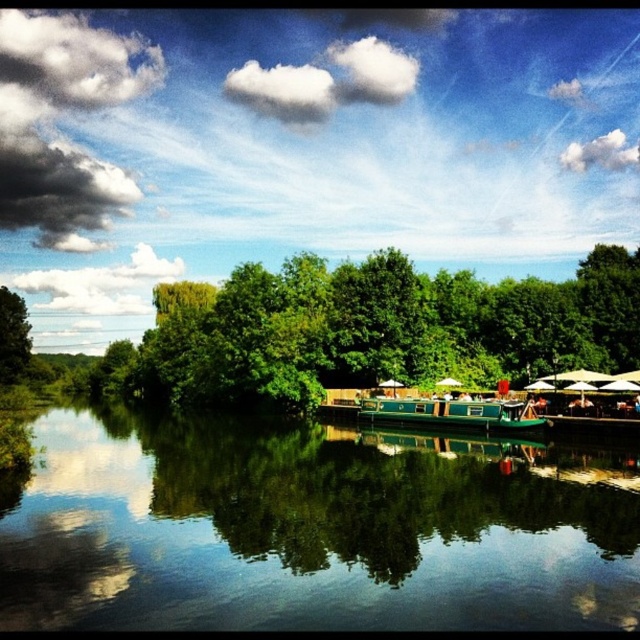
Question: Can you confirm if green glossy boat at center is positioned to the right of green polished wood boat at center?

Choices:
 (A) no
 (B) yes

Answer: (A)

Question: Which is nearer to the green glossy boat at center?

Choices:
 (A) green leafy tree at center
 (B) green leafy tree at left

Answer: (A)

Question: Which object is the farthest from the green polished wood boat at center?

Choices:
 (A) green leafy tree at left
 (B) green glossy boat at center

Answer: (A)

Question: Which point is farther from the camera taking this photo?

Choices:
 (A) (16, 353)
 (B) (468, 451)

Answer: (A)

Question: Can you confirm if green leafy tree at center is positioned above green leafy tree at left?

Choices:
 (A) no
 (B) yes

Answer: (B)

Question: Can you confirm if green leafy tree at center is positioned above green polished wood boat at center?

Choices:
 (A) yes
 (B) no

Answer: (A)